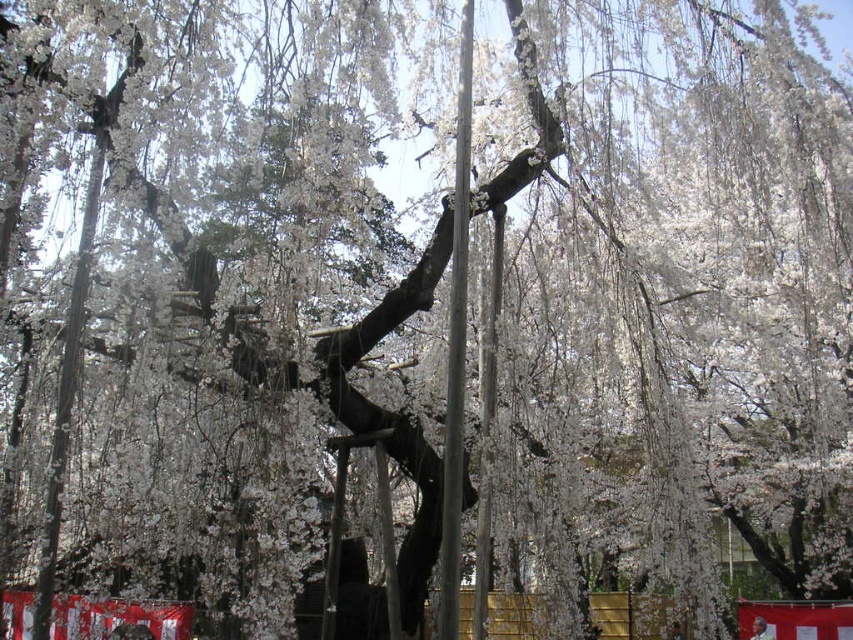
In the scene shown: Is metallic pole at center shorter than smooth metallic pole at center?

Incorrect, metallic pole at center's height does not fall short of smooth metallic pole at center's.

Does point (445, 429) come in front of point (492, 288)?

Yes, point (445, 429) is closer to viewer.

This screenshot has width=853, height=640. What are the coordinates of `metallic pole at center` in the screenshot? It's located at (456, 346).

What are the coordinates of `metallic pole at center` in the screenshot? It's located at (456, 346).